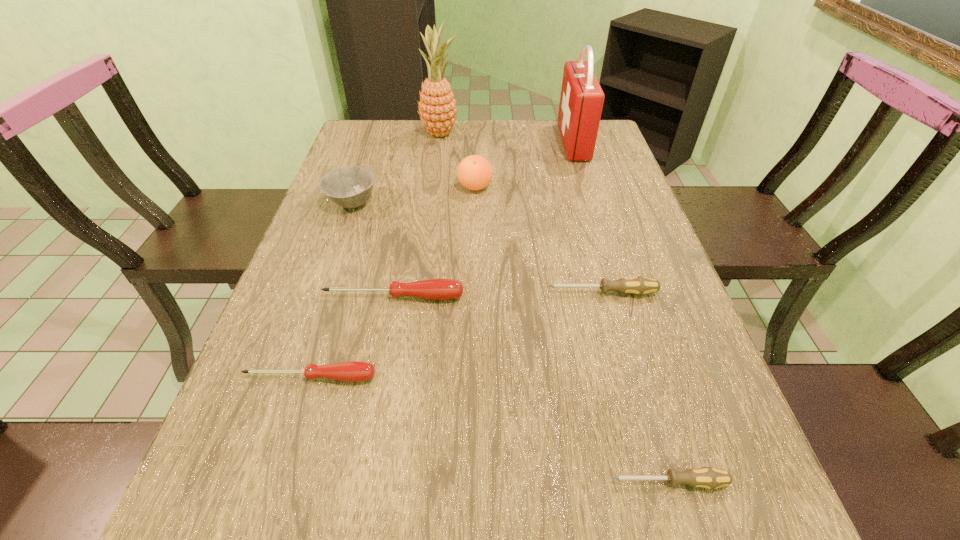
At what (x,y) coordinates should I click in order to perform the action: click on the nearest object. Please return your answer as a coordinate pair (x, y). Looking at the image, I should click on (710, 478).

You are a GUI agent. You are given a task and a screenshot of the screen. Output one action in this format:
    pyautogui.click(x=<x>, y=<y>)
    Task: Click on the nearest screwdriver
    This screenshot has height=540, width=960.
    Given the screenshot: What is the action you would take?
    coord(710,478)

Find the location of a particular element. blank space located on the right of the pineapple is located at coordinates (491, 134).

Identify the location of free space located 0.400m on the front face of the second tallest object. (437, 142).

Where is `vacant space located 0.240m on the front face of the second tallest object`? vacant space located 0.240m on the front face of the second tallest object is located at coordinates (487, 142).

Locate an element on the screen. The image size is (960, 540). free region located 0.290m on the front face of the second tallest object is located at coordinates (471, 142).

The image size is (960, 540). In order to click on free location located 0.090m on the right of the orange in this screenshot , I will do `click(524, 187)`.

Find the location of a particular element. The height and width of the screenshot is (540, 960). free space located on the front of the bowl is located at coordinates (339, 242).

Locate an element on the screen. Image resolution: width=960 pixels, height=540 pixels. free location located 0.060m on the left of the farther red screwdriver is located at coordinates (296, 297).

This screenshot has height=540, width=960. I want to click on vacant area situated 0.300m at the tip of the farther gray screwdriver, so click(408, 293).